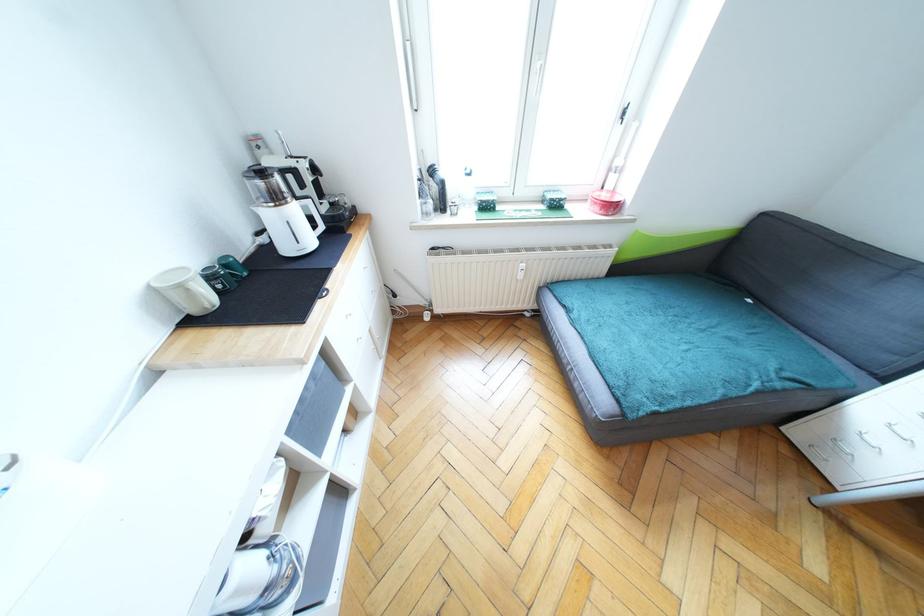
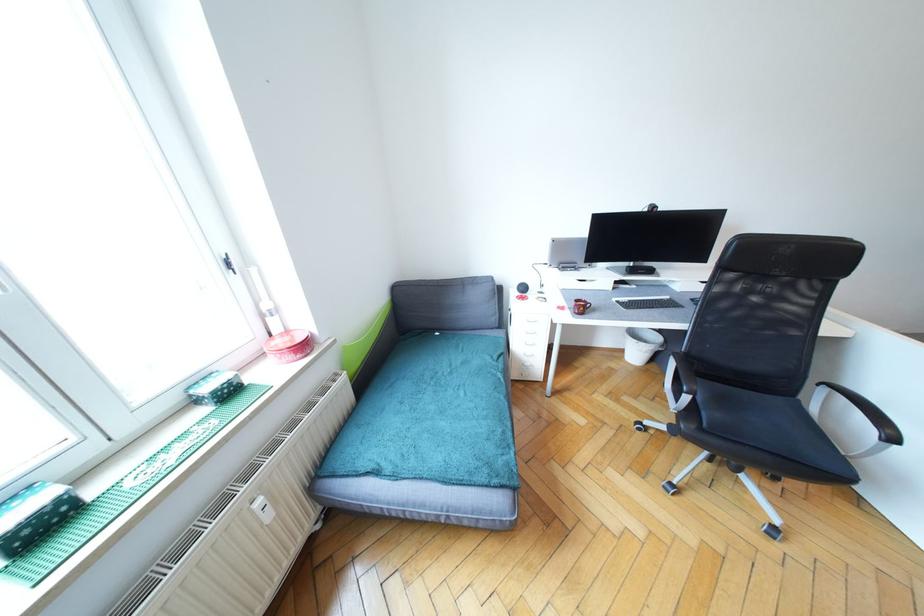
Where in the second image is the point corresponding to pixel 626 115 from the first image?

(232, 265)